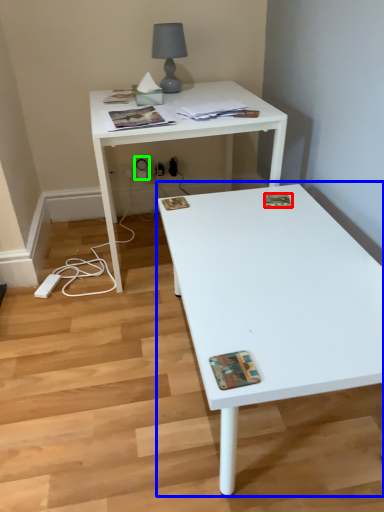
Question: Which is nearer to the magazine (highlighted by a red box)? coffee table (highlighted by a blue box) or electric outlet (highlighted by a green box).

Choices:
 (A) coffee table
 (B) electric outlet

Answer: (A)